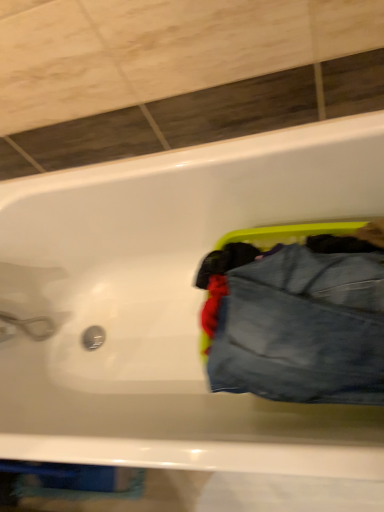
The height and width of the screenshot is (512, 384). What do you see at coordinates (169, 304) in the screenshot?
I see `white glossy bathtub at upper center` at bounding box center [169, 304].

At what (x,y) coordinates should I click in order to perform the action: click on white glossy bathtub at upper center. Please return your answer as a coordinate pair (x, y). The width and height of the screenshot is (384, 512). Looking at the image, I should click on (169, 304).

What is the approximate width of white glossy bathtub at upper center?

The width of white glossy bathtub at upper center is 27.54 inches.

In order to face white glossy bathtub at upper center, should I rotate leftwards or rightwards?

Rotate your view left by about 3.192°.

Measure the distance between white glossy bathtub at upper center and camera.

white glossy bathtub at upper center and camera are 24.88 inches apart.

What are the coordinates of `denim at right` in the screenshot? It's located at 302,328.

This screenshot has width=384, height=512. What do you see at coordinates (302, 328) in the screenshot? I see `denim at right` at bounding box center [302, 328].

In order to face denim at right, should I rotate leftwards or rightwards?

Rotate your view right by about 12.637°.

The height and width of the screenshot is (512, 384). Find the location of `white glossy bathtub at upper center`. white glossy bathtub at upper center is located at coordinates (169, 304).

Can you confirm if denim at right is positioned to the right of white glossy bathtub at upper center?

Yes, denim at right is to the right of white glossy bathtub at upper center.

Relative to white glossy bathtub at upper center, is denim at right in front or behind?

denim at right is positioned farther from the viewer than white glossy bathtub at upper center.

Which is behind, point (347, 359) or point (191, 312)?

The point (191, 312) is farther.

From the image's perspective, is denim at right under white glossy bathtub at upper center?

Actually, denim at right appears above white glossy bathtub at upper center in the image.

From a real-world perspective, which is physically above, denim at right or white glossy bathtub at upper center?

From a 3D spatial view, denim at right is above.

Considering the sizes of objects denim at right and white glossy bathtub at upper center in the image provided, who is thinner, denim at right or white glossy bathtub at upper center?

With smaller width is denim at right.

Between denim at right and white glossy bathtub at upper center, which one has more height?

Standing taller between the two is white glossy bathtub at upper center.

In terms of size, does denim at right appear bigger or smaller than white glossy bathtub at upper center?

In the image, denim at right appears to be smaller than white glossy bathtub at upper center.

Would you say white glossy bathtub at upper center is part of denim at right's contents?

No, denim at right does not contain white glossy bathtub at upper center.

Are denim at right and white glossy bathtub at upper center beside each other?

There is a gap between denim at right and white glossy bathtub at upper center.

Could you tell me if denim at right is turned towards white glossy bathtub at upper center?

Yes, denim at right faces towards white glossy bathtub at upper center.

What's the angular difference between denim at right and white glossy bathtub at upper center's facing directions?

denim at right and white glossy bathtub at upper center are facing 0.000113 degrees away from each other.

Locate an element on the screen. The height and width of the screenshot is (512, 384). bathtub in front of the denim at right is located at coordinates (169, 304).

Is white glossy bathtub at upper center at the right side of denim at right?

In fact, white glossy bathtub at upper center is to the left of denim at right.

Does white glossy bathtub at upper center come behind denim at right?

That is False.

Is point (33, 229) positioned before point (270, 325)?

No, it is behind (270, 325).

From the image's perspective, is white glossy bathtub at upper center beneath denim at right?

Correct, white glossy bathtub at upper center appears lower than denim at right in the image.

From a real-world perspective, is white glossy bathtub at upper center below denim at right?

Yes, from a real-world perspective, white glossy bathtub at upper center is under denim at right.

Is white glossy bathtub at upper center wider or thinner than denim at right?

white glossy bathtub at upper center is wider than denim at right.

Can you confirm if white glossy bathtub at upper center is shorter than denim at right?

No.

Does white glossy bathtub at upper center have a larger size compared to denim at right?

Yes, white glossy bathtub at upper center is bigger than denim at right.

Is white glossy bathtub at upper center outside of denim at right?

Absolutely, white glossy bathtub at upper center is external to denim at right.

Is white glossy bathtub at upper center next to denim at right and touching it?

No, white glossy bathtub at upper center is not touching denim at right.

Is white glossy bathtub at upper center oriented away from denim at right?

That's right, white glossy bathtub at upper center is facing away from denim at right.

Where is `bathtub beneath the denim at right (from a real-world perspective)`? This screenshot has width=384, height=512. bathtub beneath the denim at right (from a real-world perspective) is located at coordinates (169, 304).

The image size is (384, 512). Find the location of `bathtub below the denim at right (from a real-world perspective)`. bathtub below the denim at right (from a real-world perspective) is located at coordinates click(x=169, y=304).

Where is `bathtub in front of the denim at right`? The width and height of the screenshot is (384, 512). bathtub in front of the denim at right is located at coordinates (169, 304).